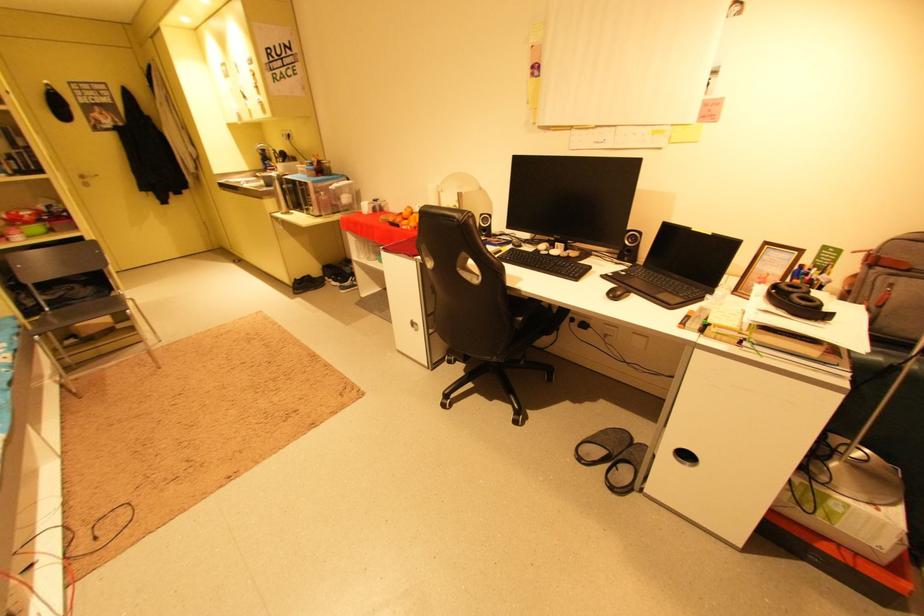
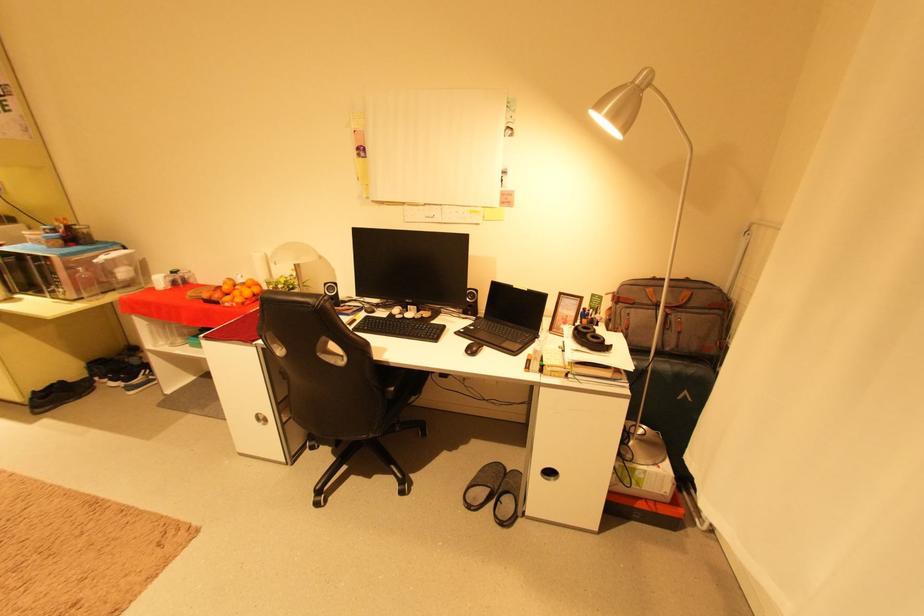
Find the pixel in the second image that matches (x=489, y=216) in the first image.

(333, 285)